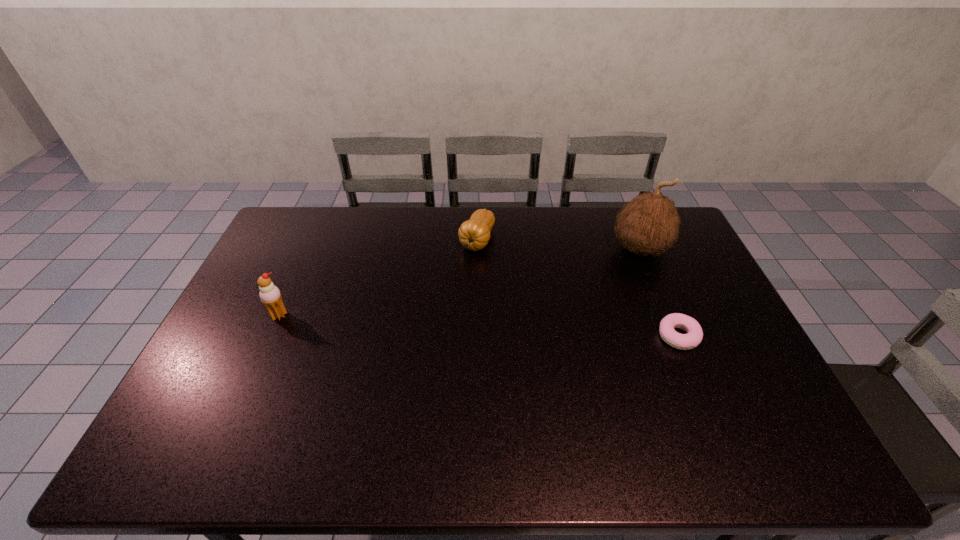
Where is `vacant space at the far edge`? This screenshot has width=960, height=540. vacant space at the far edge is located at coordinates (591, 208).

Image resolution: width=960 pixels, height=540 pixels. Find the location of `free space at the near edge of the desktop`. free space at the near edge of the desktop is located at coordinates (366, 404).

At what (x,y) coordinates should I click in order to perform the action: click on blank space at the near left corner of the desktop. Please return your answer as a coordinate pair (x, y). Image resolution: width=960 pixels, height=540 pixels. Looking at the image, I should click on (225, 396).

Locate an element on the screen. free spot between the coconut and the leftmost object is located at coordinates (460, 282).

The image size is (960, 540). I want to click on free spot between the second tallest object and the third tallest object, so click(378, 278).

Where is `vacant point located between the shortest object and the coconut`? vacant point located between the shortest object and the coconut is located at coordinates (660, 293).

At what (x,y) coordinates should I click in order to perform the action: click on vacant area between the second tallest object and the pastry. Please return your answer as a coordinate pair (x, y). Looking at the image, I should click on (478, 326).

Locate an element on the screen. The image size is (960, 540). free space between the third tallest object and the pastry is located at coordinates (578, 288).

Identify the location of free point between the gourd and the tallest object. (559, 245).

Image resolution: width=960 pixels, height=540 pixels. Identify the location of free point between the coconut and the second shortest object. point(559,245).